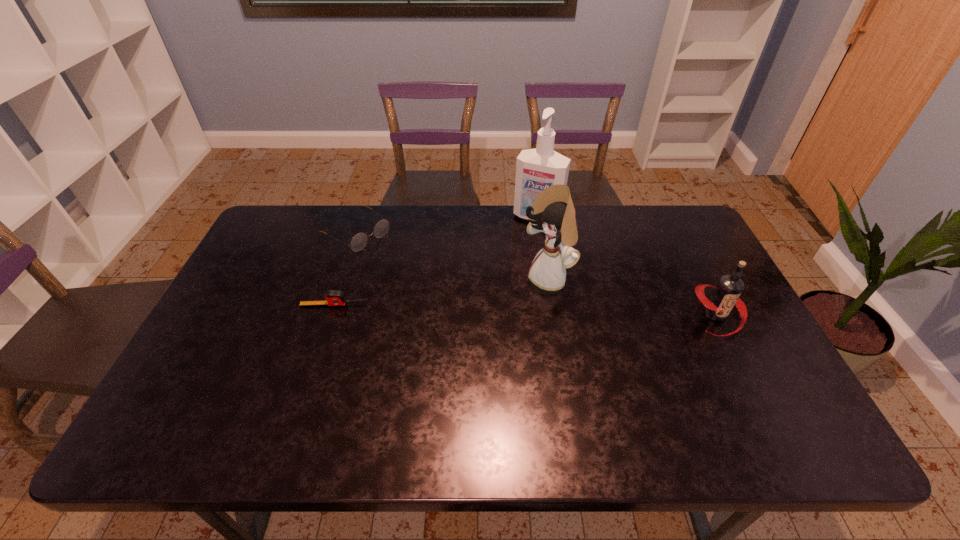
I want to click on vacant spot on the desktop that is between the shortest object and the root beer and is positioned on the front label of the tallest object, so click(x=489, y=308).

The image size is (960, 540). What are the coordinates of `free spot on the desktop that is between the shortest object and the root beer and is positioned at the front face of the fourth shortest object` in the screenshot? It's located at (481, 308).

The image size is (960, 540). In order to click on vacant spot on the desktop that is between the shortest object and the root beer and is positioned on the temples of the spectacles in this screenshot , I will do `click(470, 308)`.